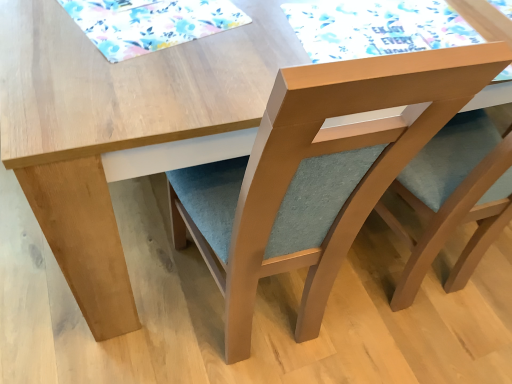
Question: Which direction should I rotate to face watercolor paper placemat at upper center, the second mat from the left, — up or down?

Choices:
 (A) down
 (B) up

Answer: (B)

Question: Is matte wood chair at center smaller than floral fabric placemat at upper left, which is the second mat from right to left?

Choices:
 (A) no
 (B) yes

Answer: (A)

Question: Can you confirm if matte wood chair at center is thinner than floral fabric placemat at upper left, acting as the 1th mat starting from the left?

Choices:
 (A) no
 (B) yes

Answer: (A)

Question: Considering the relative positions of matte wood chair at center and floral fabric placemat at upper left, which is the second mat from right to left, in the image provided, is matte wood chair at center to the left of floral fabric placemat at upper left, which is the second mat from right to left, from the viewer's perspective?

Choices:
 (A) yes
 (B) no

Answer: (B)

Question: From the image's perspective, is matte wood chair at center on floral fabric placemat at upper left, which is the second mat from right to left?

Choices:
 (A) no
 (B) yes

Answer: (A)

Question: Considering the relative sizes of matte wood chair at center and floral fabric placemat at upper left, acting as the 1th mat starting from the left, in the image provided, is matte wood chair at center taller than floral fabric placemat at upper left, acting as the 1th mat starting from the left,?

Choices:
 (A) yes
 (B) no

Answer: (A)

Question: Is matte wood chair at center located outside floral fabric placemat at upper left, which is the second mat from right to left?

Choices:
 (A) no
 (B) yes

Answer: (B)

Question: Does watercolor paper placemat at upper center, the second mat from the left, lie behind floral fabric placemat at upper left, acting as the 1th mat starting from the left?

Choices:
 (A) yes
 (B) no

Answer: (A)

Question: From the image's perspective, is watercolor paper placemat at upper center, the second mat from the left, under floral fabric placemat at upper left, which is the second mat from right to left?

Choices:
 (A) yes
 (B) no

Answer: (A)

Question: Can you confirm if watercolor paper placemat at upper center, which is counted as the first mat, starting from the right, is bigger than floral fabric placemat at upper left, acting as the 1th mat starting from the left?

Choices:
 (A) yes
 (B) no

Answer: (A)

Question: Is watercolor paper placemat at upper center, which is counted as the first mat, starting from the right, positioned in front of floral fabric placemat at upper left, which is the second mat from right to left?

Choices:
 (A) no
 (B) yes

Answer: (A)

Question: Can you confirm if watercolor paper placemat at upper center, the second mat from the left, is smaller than floral fabric placemat at upper left, which is the second mat from right to left?

Choices:
 (A) yes
 (B) no

Answer: (B)

Question: From the image's perspective, is watercolor paper placemat at upper center, which is counted as the first mat, starting from the right, located above floral fabric placemat at upper left, which is the second mat from right to left?

Choices:
 (A) yes
 (B) no

Answer: (B)

Question: Is matte wood chair at center facing towards watercolor paper placemat at upper center, the second mat from the left?

Choices:
 (A) no
 (B) yes

Answer: (A)